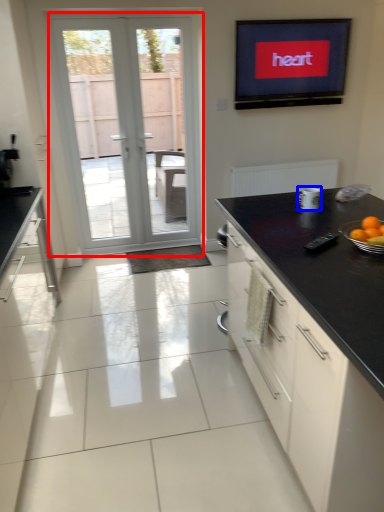
Question: Which object appears farthest to the camera in this image, door (highlighted by a red box) or appliance (highlighted by a blue box)?

Choices:
 (A) door
 (B) appliance

Answer: (A)